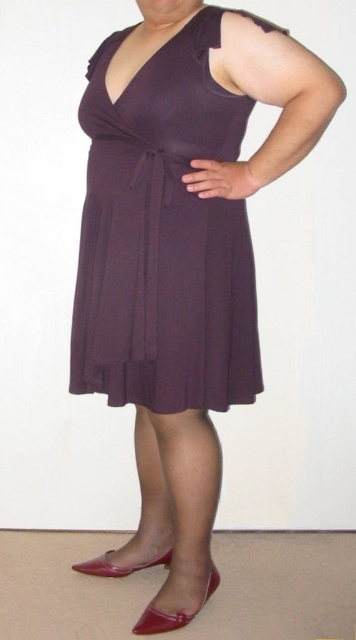
You are a fashion designer trying to create a new outfit. You want to ensure that the matte purple dress at center is visible over the shiny patent leather heel at lower center. Based on their positions in the image, can you confirm if the dress is covering part of the heel?

The matte purple dress at center is in front of the shiny patent leather heel at lower center, so yes, the dress is covering part of the shiny patent leather heel at lower center.

You are taking a photo of the person in the image. You want to focus on the point that is closer to the camera. Which point should you choose between point (127, 88) and point (154, 609)?

Point (127, 88) is closer to the camera than point (154, 609), so you should choose point (127, 88) to focus on.